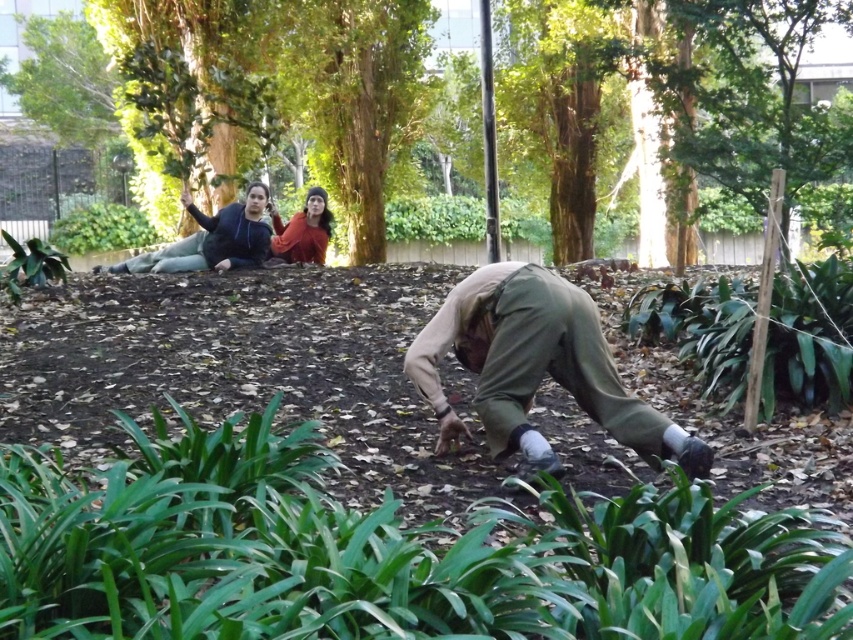
Measure the distance from matte khaki pants at center to green fabric gardener at upper center.

6.02 meters

Does matte khaki pants at center have a greater height compared to green fabric gardener at upper center?

Indeed, matte khaki pants at center has a greater height compared to green fabric gardener at upper center.

You are a GUI agent. You are given a task and a screenshot of the screen. Output one action in this format:
    pyautogui.click(x=<x>, y=<y>)
    Task: Click on the matte khaki pants at center
    Image resolution: width=853 pixels, height=640 pixels.
    Given the screenshot: What is the action you would take?
    pyautogui.click(x=537, y=368)

Is brown textured tree at upper center shorter than orange sweater at upper center?

No, brown textured tree at upper center is not shorter than orange sweater at upper center.

Can you confirm if brown textured tree at upper center is positioned to the left of orange sweater at upper center?

Incorrect, brown textured tree at upper center is not on the left side of orange sweater at upper center.

Describe the element at coordinates (734, 145) in the screenshot. I see `brown textured tree at upper center` at that location.

The height and width of the screenshot is (640, 853). I want to click on brown textured tree at upper center, so (734, 145).

Does matte khaki pants at center come in front of orange sweater at upper center?

Yes, matte khaki pants at center is in front of orange sweater at upper center.

The width and height of the screenshot is (853, 640). Find the location of `matte khaki pants at center`. matte khaki pants at center is located at coordinates (537, 368).